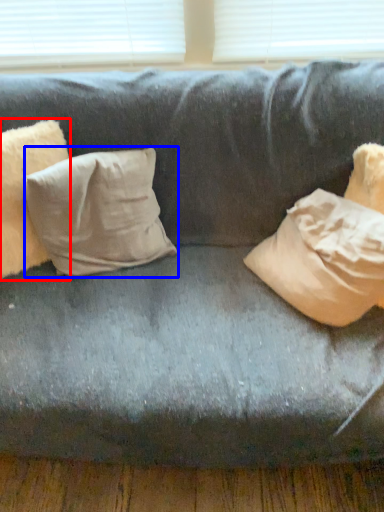
Question: Which object appears farthest to the camera in this image, pillow (highlighted by a red box) or pillow (highlighted by a blue box)?

Choices:
 (A) pillow
 (B) pillow

Answer: (B)